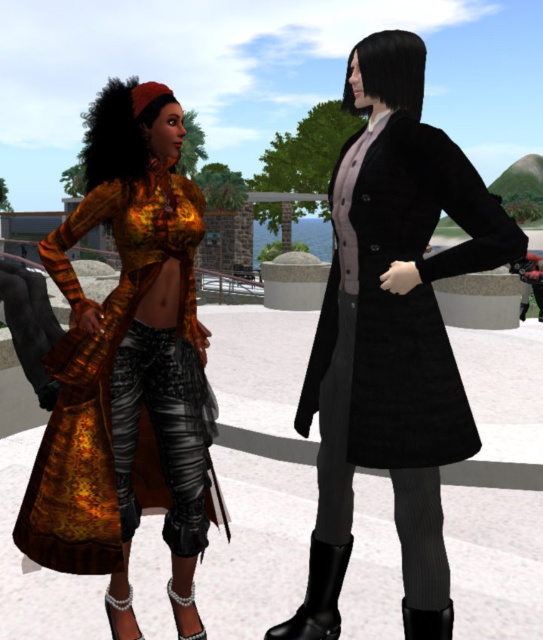
Question: Is pearl-embellished boot at lower left above shiny metallic boot at lower center?

Choices:
 (A) yes
 (B) no

Answer: (A)

Question: Which object is positioned farthest from the shiny metallic boot at lower center?

Choices:
 (A) pearl-embellished boot at lower left
 (B) shiny metallic dress at center
 (C) black leather boot at lower center

Answer: (B)

Question: Does black leather boot at lower center appear over pearl-embellished boot at lower left?

Choices:
 (A) no
 (B) yes

Answer: (B)

Question: Estimate the real-world distances between objects in this image. Which object is farther from the black leather boot at lower right?

Choices:
 (A) black velvet coat at center
 (B) black leather boot at lower center

Answer: (A)

Question: Is shiny metallic dress at center below black leather boot at lower right?

Choices:
 (A) yes
 (B) no

Answer: (B)

Question: Among these objects, which one is farthest from the camera?

Choices:
 (A) black velvet coat at center
 (B) black leather boot at lower right

Answer: (B)